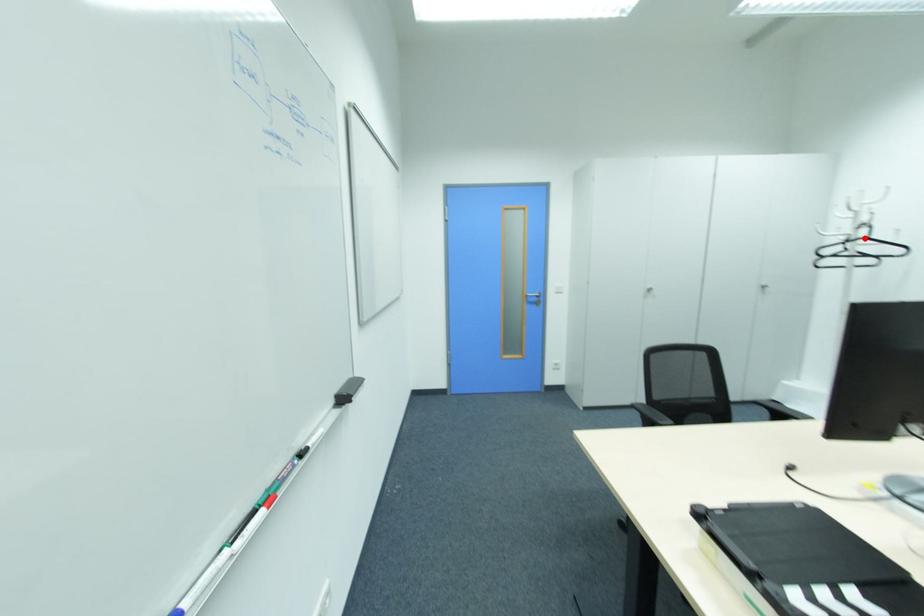
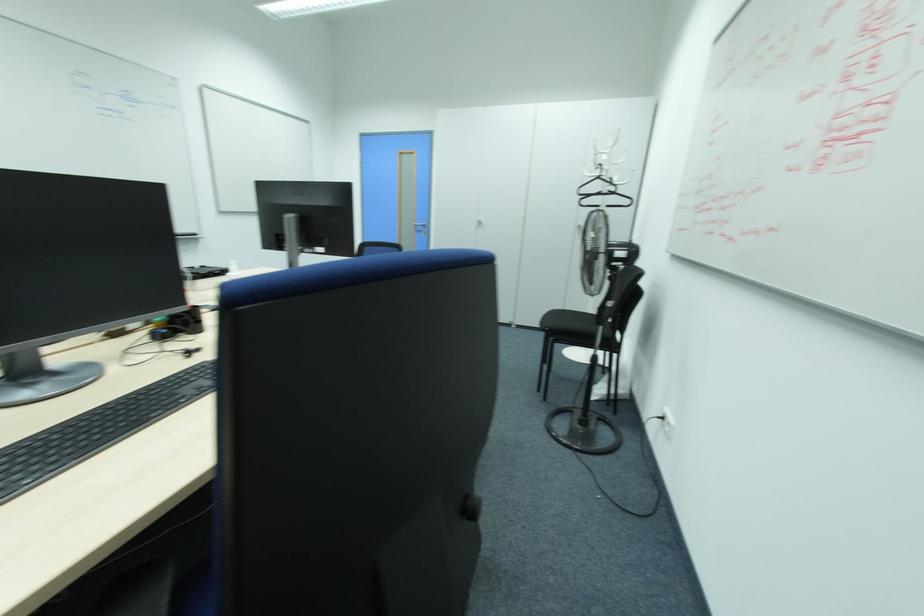
The point at the highlighted location is marked in the first image. Where is the corresponding point in the second image?

(599, 177)